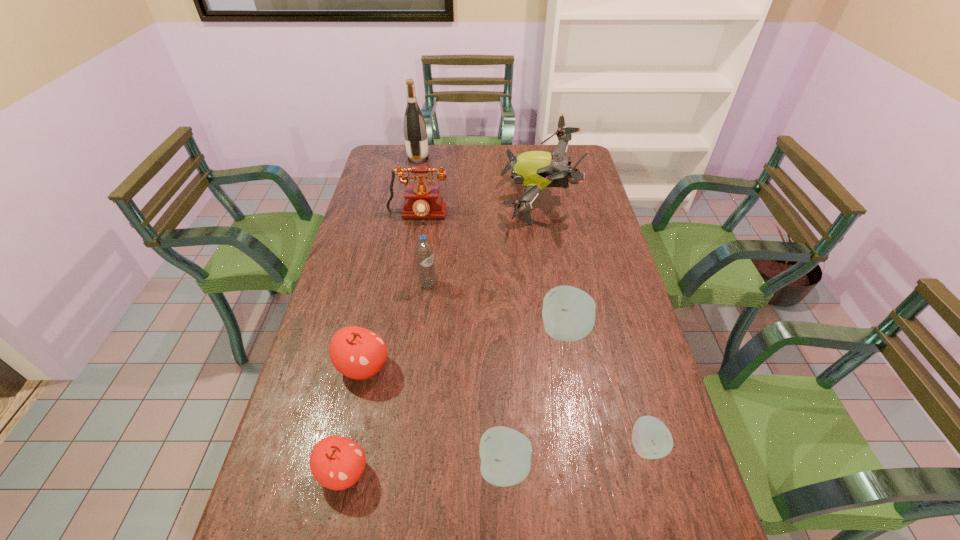
Identify which red apple is located as the nearest to the rightmost white apple. Please provide its 2D coordinates. Your answer should be formatted as a tuple, i.e. [(x, y)], where the tuple contains the x and y coordinates of a point satisfying the conditions above.

[(336, 462)]

Find the location of a particular element. The height and width of the screenshot is (540, 960). vacant space that satisfies the following two spatial constraints: 1. on the dial of the telephone; 2. on the right side of the second biggest white apple is located at coordinates [376, 468].

Where is `vacant space that satisfies the following two spatial constraints: 1. on the label of the brown wine bottle; 2. on the back side of the leftmost white apple`? This screenshot has height=540, width=960. vacant space that satisfies the following two spatial constraints: 1. on the label of the brown wine bottle; 2. on the back side of the leftmost white apple is located at coordinates (359, 468).

This screenshot has height=540, width=960. What are the coordinates of `free region that satisfies the following two spatial constraints: 1. on the label of the farthest object; 2. on the front side of the farther red apple` in the screenshot? It's located at tap(378, 367).

You are a GUI agent. You are given a task and a screenshot of the screen. Output one action in this format:
    pyautogui.click(x=<x>, y=<y>)
    Task: Click on the vacant area in the image that satisfies the following two spatial constraints: 1. on the dial of the telephone; 2. on the left side of the fourth farthest object
    
    Given the screenshot: What is the action you would take?
    pyautogui.click(x=406, y=285)

Where is `free space in the image that satisfies the following two spatial constraints: 1. on the back side of the rightmost apple; 2. on the right side of the nearer red apple`? free space in the image that satisfies the following two spatial constraints: 1. on the back side of the rightmost apple; 2. on the right side of the nearer red apple is located at coordinates (349, 446).

The image size is (960, 540). I want to click on vacant space that satisfies the following two spatial constraints: 1. on the label of the tallest object; 2. on the left side of the rightmost white apple, so click(363, 446).

Find the location of a particular element. The width and height of the screenshot is (960, 540). free space that satisfies the following two spatial constraints: 1. on the dial of the telephone; 2. on the left side of the leftmost white apple is located at coordinates 376,468.

Locate an element on the screen. Image resolution: width=960 pixels, height=540 pixels. vacant space that satisfies the following two spatial constraints: 1. on the back side of the rightmost apple; 2. on the front-facing side of the drone is located at coordinates (579, 200).